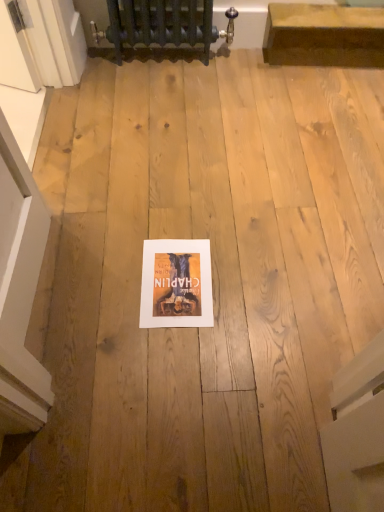
Identify the location of free space to the back side of matte paper poster at center. Image resolution: width=384 pixels, height=512 pixels. (176, 211).